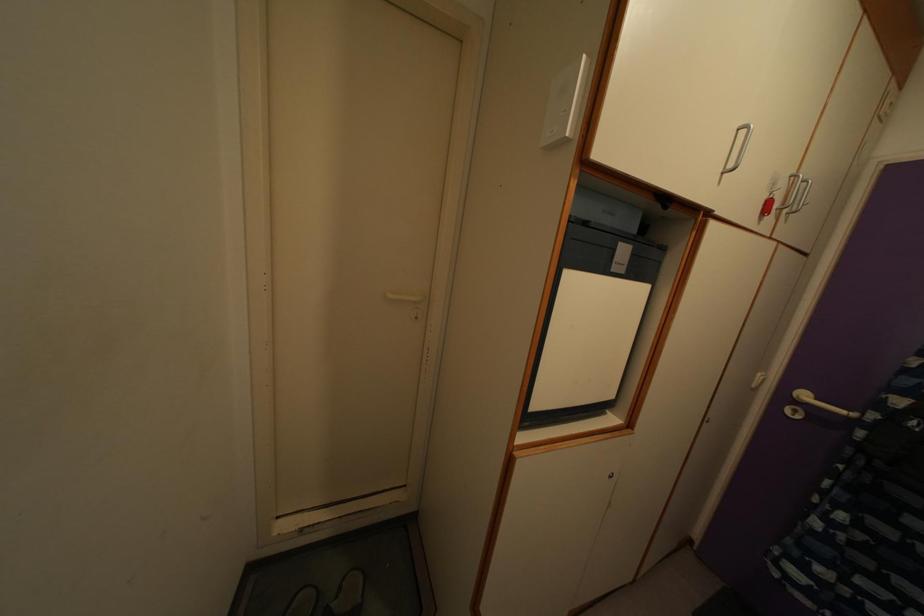
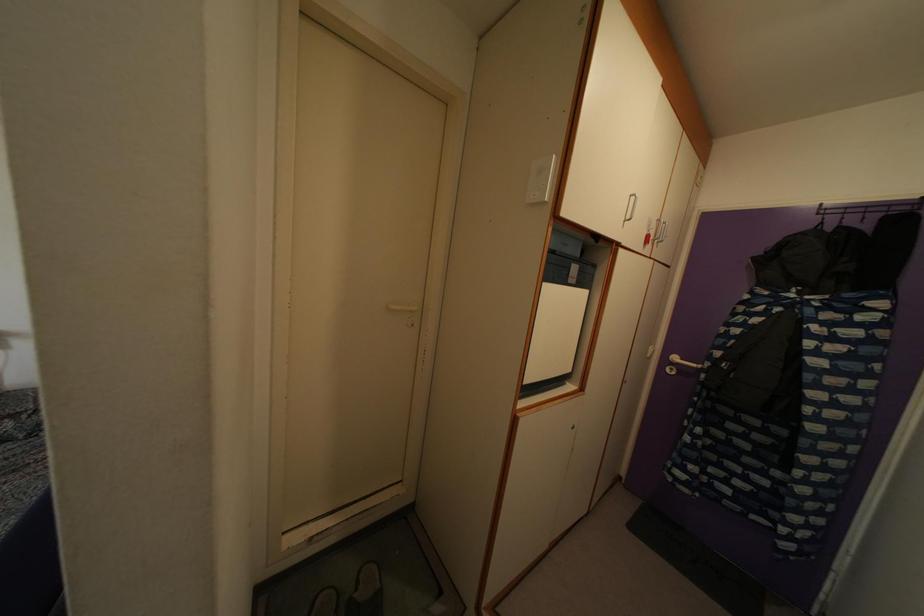
Which direction would the cameraman need to move to produce the second image?

The movement direction of the cameraman is left, backward.